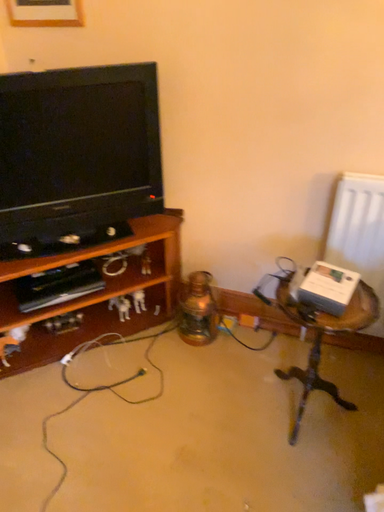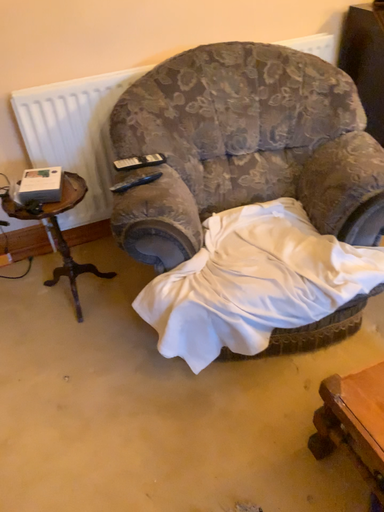
Question: How did the camera likely rotate when shooting the video?

Choices:
 (A) rotated right
 (B) rotated left

Answer: (A)